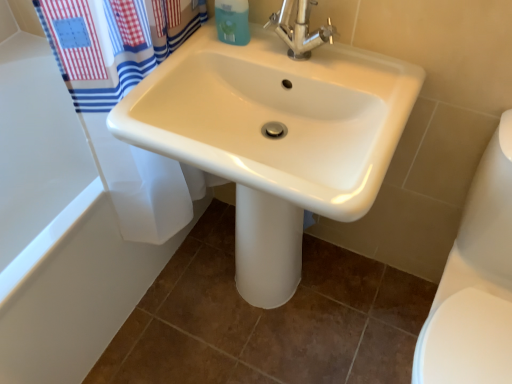
Question: Is white glossy toilet bowl at lower right thinner than chrome metallic faucet at upper center?

Choices:
 (A) no
 (B) yes

Answer: (A)

Question: Does white glossy toilet bowl at lower right have a larger size compared to chrome metallic faucet at upper center?

Choices:
 (A) no
 (B) yes

Answer: (B)

Question: From the image's perspective, is white glossy toilet bowl at lower right under chrome metallic faucet at upper center?

Choices:
 (A) no
 (B) yes

Answer: (B)

Question: From a real-world perspective, is white glossy toilet bowl at lower right positioned under chrome metallic faucet at upper center based on gravity?

Choices:
 (A) yes
 (B) no

Answer: (A)

Question: Can we say white glossy toilet bowl at lower right lies outside chrome metallic faucet at upper center?

Choices:
 (A) yes
 (B) no

Answer: (A)

Question: In terms of height, does white glossy bathtub at upper left look taller or shorter compared to chrome metallic faucet at upper center?

Choices:
 (A) tall
 (B) short

Answer: (A)

Question: Considering the relative positions of white glossy bathtub at upper left and chrome metallic faucet at upper center in the image provided, is white glossy bathtub at upper left to the left or to the right of chrome metallic faucet at upper center?

Choices:
 (A) left
 (B) right

Answer: (A)

Question: Considering the positions of point (12, 213) and point (313, 46), is point (12, 213) closer or farther from the camera than point (313, 46)?

Choices:
 (A) closer
 (B) farther

Answer: (B)

Question: Looking at their shapes, would you say white glossy bathtub at upper left is wider or thinner than chrome metallic faucet at upper center?

Choices:
 (A) thin
 (B) wide

Answer: (B)

Question: From a real-world perspective, is white glossy toilet bowl at lower right above or below chrome metallic faucet at upper center?

Choices:
 (A) below
 (B) above

Answer: (A)

Question: Is white glossy toilet bowl at lower right spatially inside chrome metallic faucet at upper center, or outside of it?

Choices:
 (A) outside
 (B) inside

Answer: (A)

Question: In terms of width, does white glossy toilet bowl at lower right look wider or thinner when compared to chrome metallic faucet at upper center?

Choices:
 (A) thin
 (B) wide

Answer: (B)

Question: Considering the positions of point pyautogui.click(x=492, y=284) and point pyautogui.click(x=297, y=14), is point pyautogui.click(x=492, y=284) closer or farther from the camera than point pyautogui.click(x=297, y=14)?

Choices:
 (A) closer
 (B) farther

Answer: (B)

Question: From the image's perspective, relative to white glossy bathtub at upper left, is blue matte soap dispenser at upper center above or below?

Choices:
 (A) below
 (B) above

Answer: (B)

Question: Is blue matte soap dispenser at upper center to the left or to the right of white glossy bathtub at upper left in the image?

Choices:
 (A) right
 (B) left

Answer: (A)